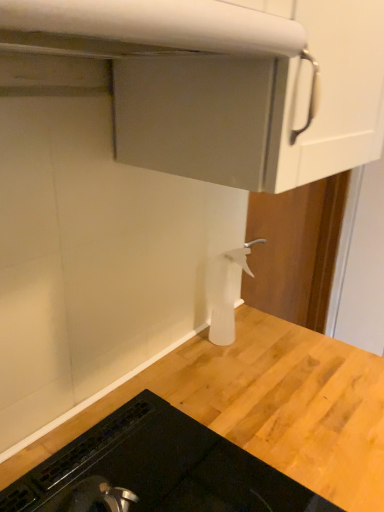
Question: From the image's perspective, is white matte exhaust hood at upper center on top of black glass stovetop at lower left?

Choices:
 (A) no
 (B) yes

Answer: (B)

Question: Does white matte exhaust hood at upper center have a larger size compared to black glass stovetop at lower left?

Choices:
 (A) no
 (B) yes

Answer: (A)

Question: Does white matte exhaust hood at upper center have a lesser height compared to black glass stovetop at lower left?

Choices:
 (A) no
 (B) yes

Answer: (B)

Question: Considering the relative positions of white matte exhaust hood at upper center and black glass stovetop at lower left in the image provided, is white matte exhaust hood at upper center to the right of black glass stovetop at lower left from the viewer's perspective?

Choices:
 (A) no
 (B) yes

Answer: (A)

Question: From the image's perspective, is white matte exhaust hood at upper center under black glass stovetop at lower left?

Choices:
 (A) yes
 (B) no

Answer: (B)

Question: Is white matte exhaust hood at upper center positioned behind black glass stovetop at lower left?

Choices:
 (A) no
 (B) yes

Answer: (A)

Question: Can you confirm if black glass stovetop at lower left is smaller than white plastic spray bottle at center?

Choices:
 (A) no
 (B) yes

Answer: (A)

Question: From a real-world perspective, is black glass stovetop at lower left positioned under white plastic spray bottle at center based on gravity?

Choices:
 (A) no
 (B) yes

Answer: (B)

Question: Is black glass stovetop at lower left next to white plastic spray bottle at center and touching it?

Choices:
 (A) yes
 (B) no

Answer: (B)

Question: Could you tell me if black glass stovetop at lower left is facing white plastic spray bottle at center?

Choices:
 (A) no
 (B) yes

Answer: (A)

Question: Is black glass stovetop at lower left far away from white plastic spray bottle at center?

Choices:
 (A) no
 (B) yes

Answer: (A)

Question: Could white plastic spray bottle at center be considered to be inside black glass stovetop at lower left?

Choices:
 (A) yes
 (B) no

Answer: (B)

Question: Does white matte exhaust hood at upper center have a greater height compared to white plastic spray bottle at center?

Choices:
 (A) yes
 (B) no

Answer: (B)